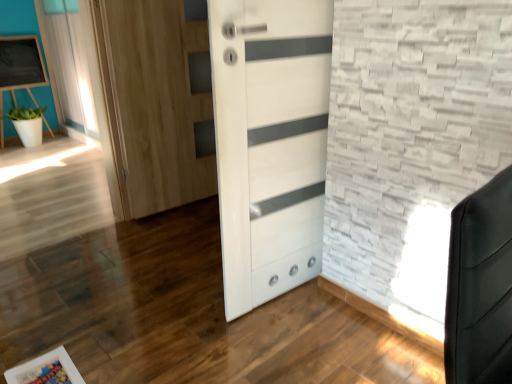
Question: In terms of size, does white sheer curtain at upper left appear bigger or smaller than wooden picture frame at lower left?

Choices:
 (A) big
 (B) small

Answer: (A)

Question: From a real-world perspective, is white sheer curtain at upper left above or below wooden picture frame at lower left?

Choices:
 (A) below
 (B) above

Answer: (B)

Question: Which object is positioned closest to the white glossy door at center?

Choices:
 (A) white matte pot at left
 (B) white sheer curtain at upper left
 (C) matte black chalkboard at upper left
 (D) wooden picture frame at lower left

Answer: (D)

Question: Which is nearer to the wooden picture frame at lower left?

Choices:
 (A) white matte pot at left
 (B) white glossy door at center
 (C) matte black chalkboard at upper left
 (D) white sheer curtain at upper left

Answer: (B)